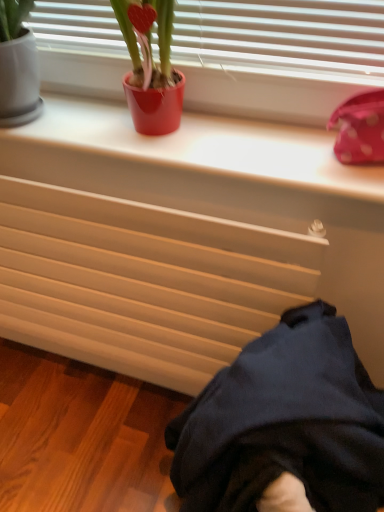
Question: From a real-world perspective, is dark blue fabric at lower right above or below matte beige radiator at lower center?

Choices:
 (A) above
 (B) below

Answer: (B)

Question: Based on their sizes in the image, would you say dark blue fabric at lower right is bigger or smaller than matte beige radiator at lower center?

Choices:
 (A) small
 (B) big

Answer: (B)

Question: Estimate the real-world distances between objects in this image. Which object is closer to the shiny red pot at upper center?

Choices:
 (A) dark blue fabric at lower right
 (B) white smooth window sill at upper center
 (C) matte beige radiator at lower center

Answer: (B)

Question: Which is farther from the white smooth window sill at upper center?

Choices:
 (A) dark blue fabric at lower right
 (B) matte beige radiator at lower center
 (C) shiny red pot at upper center

Answer: (A)